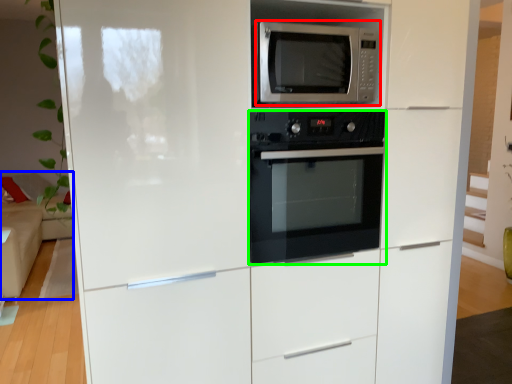
Question: Which object is positioned farthest from microwave oven (highlighted by a red box)? Select from couch (highlighted by a blue box) and oven (highlighted by a green box).

Choices:
 (A) couch
 (B) oven

Answer: (A)